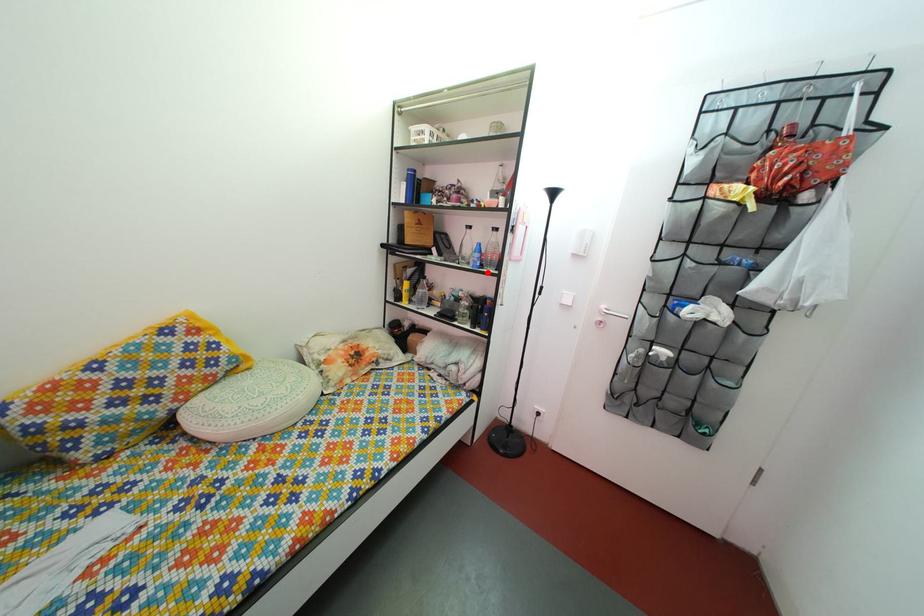
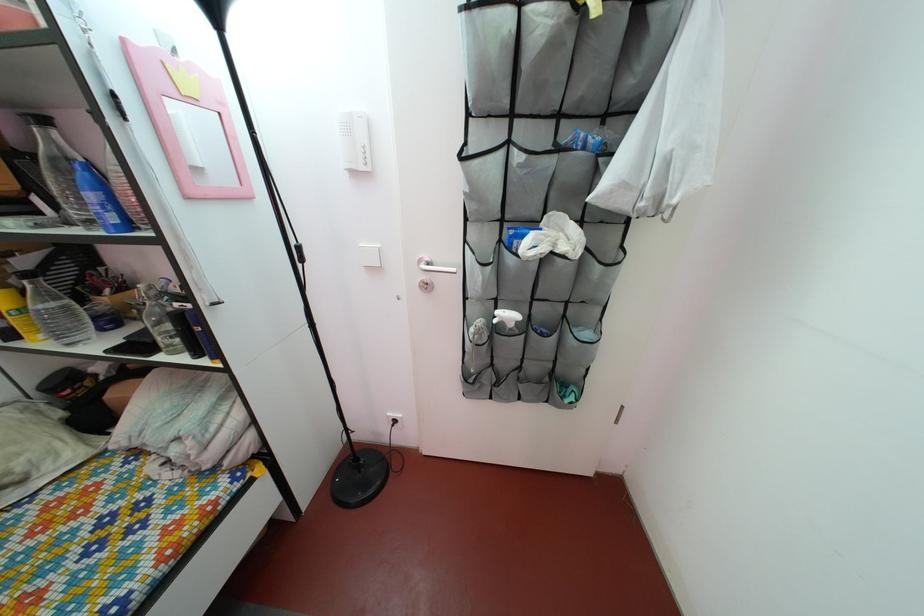
Question: I am providing you with two images of the same scene from different viewpoints. Given a red point in image1, look at the same physical point in image2. Is it:

Choices:
 (A) Closer to the viewpoint
 (B) Farther from the viewpoint

Answer: (B)